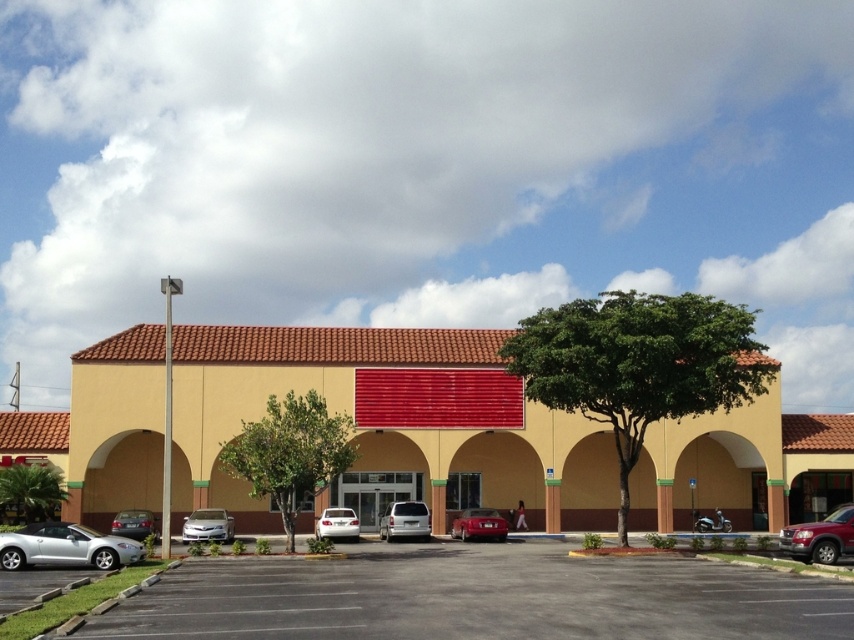
Question: Which of the following is the closest to the observer?

Choices:
 (A) (334, 520)
 (B) (83, 545)
 (C) (771, 609)
 (D) (395, 509)

Answer: (C)

Question: Which of these objects is positioned farthest from the shiny red car at center?

Choices:
 (A) metallic red suv at lower right
 (B) gray asphalt parking lot at lower center
 (C) silver metallic van at center

Answer: (B)

Question: Is gray asphalt parking lot at lower center further to camera compared to shiny red car at center?

Choices:
 (A) no
 (B) yes

Answer: (A)

Question: Is yellow stucco building at center bigger than metallic red suv at lower right?

Choices:
 (A) no
 (B) yes

Answer: (B)

Question: Which of the following is the closest to the observer?

Choices:
 (A) (34, 536)
 (B) (221, 532)
 (C) (117, 531)

Answer: (A)

Question: Is silver metallic sedan at lower left to the left of shiny red car at center from the viewer's perspective?

Choices:
 (A) yes
 (B) no

Answer: (A)